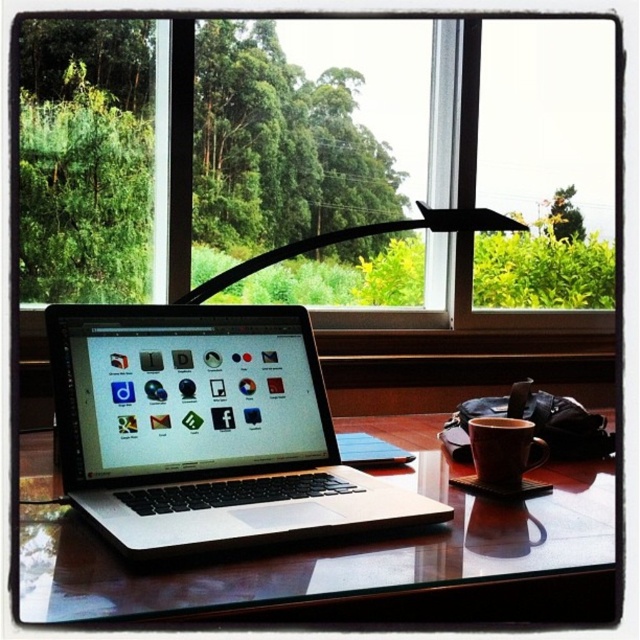
Question: Can you confirm if transparent glass window at center is positioned above matte ceramic mug at center?

Choices:
 (A) yes
 (B) no

Answer: (A)

Question: Is silver/black laptop at center closer to camera compared to black plastic lamp at center?

Choices:
 (A) yes
 (B) no

Answer: (A)

Question: Is transparent glass window at center in front of matte ceramic mug at center?

Choices:
 (A) yes
 (B) no

Answer: (B)

Question: Which point is farther from the camera taking this photo?

Choices:
 (A) (541, 486)
 (B) (429, 216)
 (C) (422, 154)
 (D) (314, 381)

Answer: (C)

Question: Which object appears closest to the camera in this image?

Choices:
 (A) transparent glass window at center
 (B) silver/black laptop at center
 (C) matte ceramic mug at center

Answer: (B)

Question: Estimate the real-world distances between objects in this image. Which object is farther from the matte ceramic mug at center?

Choices:
 (A) transparent glass window at center
 (B) glossy wooden table at center
 (C) black plastic lamp at center
 (D) silver/black laptop at center

Answer: (A)